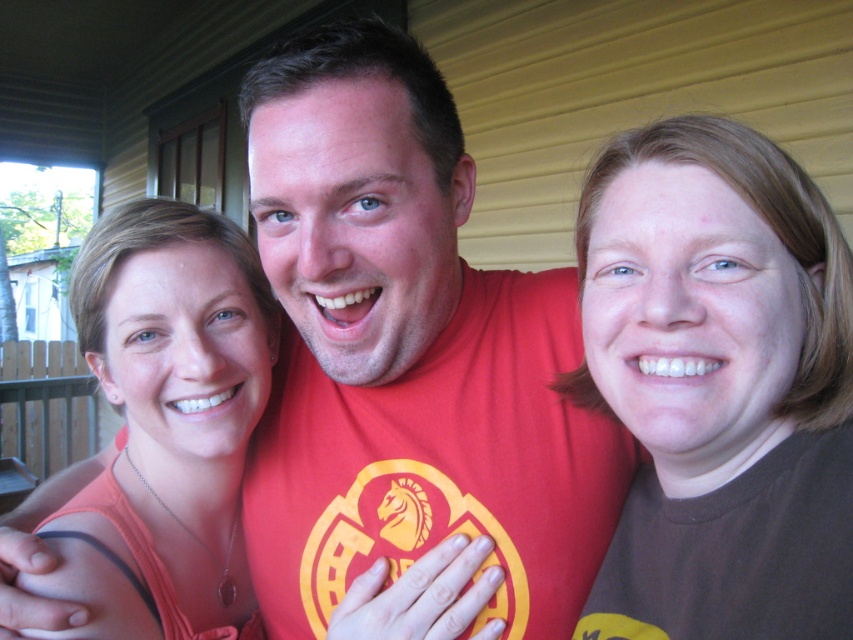
Can you confirm if brown matte hair at upper right is smaller than matte orange tank top at center?

Correct, brown matte hair at upper right occupies less space than matte orange tank top at center.

Between point (633, 618) and point (225, 438), which one is positioned behind?

The point (225, 438) is behind.

Where is `brown matte hair at upper right`? This screenshot has height=640, width=853. brown matte hair at upper right is located at coordinates (718, 385).